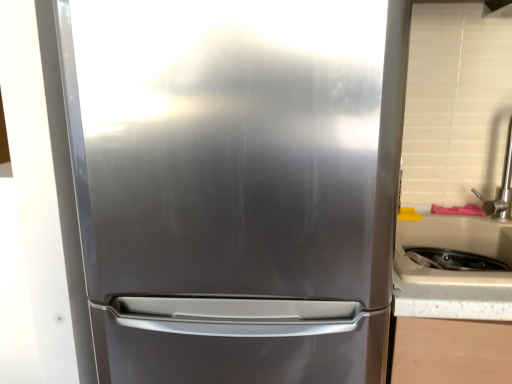
Measure the distance between satin nickel faucet at right and camera.

A distance of 1.27 meters exists between satin nickel faucet at right and camera.

This screenshot has height=384, width=512. What do you see at coordinates (452, 305) in the screenshot?
I see `white speckled laminate at right` at bounding box center [452, 305].

The image size is (512, 384). In order to click on white speckled laminate at right in this screenshot , I will do `click(452, 305)`.

Identify the location of brushed metal exhaust hood at upper right. The image size is (512, 384). (497, 9).

You are a GUI agent. You are given a task and a screenshot of the screen. Output one action in this format:
    pyautogui.click(x=<x>, y=<y>)
    Task: Click on the satin nickel faucet at right
    Image resolution: width=512 pixels, height=384 pixels.
    Given the screenshot: What is the action you would take?
    pyautogui.click(x=501, y=187)

Can you tell me how much stainless steel refrigerator at center and white speckled laminate at right differ in facing direction?

The angular difference between stainless steel refrigerator at center and white speckled laminate at right is 2.15e-05 degrees.

Is stainless steel refrigerator at center in front of white speckled laminate at right?

Yes, stainless steel refrigerator at center is in front of white speckled laminate at right.

Is point (244, 366) closer or farther from the camera than point (402, 227)?

Clearly, point (244, 366) is closer to the camera than point (402, 227).

Is white speckled laminate at right far away from stainless steel refrigerator at center?

No.

From the image's perspective, which one is positioned lower, white speckled laminate at right or stainless steel refrigerator at center?

white speckled laminate at right, from the image's perspective.

Based on their positions, is white speckled laminate at right located to the left or right of stainless steel refrigerator at center?

white speckled laminate at right is to the right of stainless steel refrigerator at center.

Is white speckled laminate at right behind stainless steel refrigerator at center?

Yes, white speckled laminate at right is further from the camera.

From the image's perspective, which is below, white speckled laminate at right or brushed metal exhaust hood at upper right?

white speckled laminate at right.

Is white speckled laminate at right touching brushed metal exhaust hood at upper right?

white speckled laminate at right and brushed metal exhaust hood at upper right are not in contact.

Considering the sizes of objects white speckled laminate at right and brushed metal exhaust hood at upper right in the image provided, who is bigger, white speckled laminate at right or brushed metal exhaust hood at upper right?

white speckled laminate at right.

How distant is white speckled laminate at right from brushed metal exhaust hood at upper right?

white speckled laminate at right and brushed metal exhaust hood at upper right are 34.41 inches apart.

Considering the points (503, 173) and (443, 303), which point is in front, point (503, 173) or point (443, 303)?

The point (443, 303) is more forward.

From a real-world perspective, is satin nickel faucet at right located higher than white speckled laminate at right?

Correct, in the physical world, satin nickel faucet at right is higher than white speckled laminate at right.

How much distance is there between satin nickel faucet at right and white speckled laminate at right?

The distance of satin nickel faucet at right from white speckled laminate at right is 22.95 inches.

Would you say satin nickel faucet at right is inside or outside white speckled laminate at right?

satin nickel faucet at right is outside white speckled laminate at right.

Is stainless steel refrigerator at center next to brushed metal exhaust hood at upper right and touching it?

They are not placed beside each other.

Is stainless steel refrigerator at center wider than brushed metal exhaust hood at upper right?

Indeed, stainless steel refrigerator at center has a greater width compared to brushed metal exhaust hood at upper right.

Which object is more forward, stainless steel refrigerator at center or brushed metal exhaust hood at upper right?

stainless steel refrigerator at center.

Which of these two, stainless steel refrigerator at center or brushed metal exhaust hood at upper right, is bigger?

With larger size is stainless steel refrigerator at center.

From the image's perspective, between stainless steel refrigerator at center and satin nickel faucet at right, which one is located above?

satin nickel faucet at right is shown above in the image.

From the picture: Does stainless steel refrigerator at center have a lesser height compared to satin nickel faucet at right?

No.

Which is more to the left, stainless steel refrigerator at center or satin nickel faucet at right?

Positioned to the left is stainless steel refrigerator at center.

How many degrees apart are the facing directions of stainless steel refrigerator at center and satin nickel faucet at right?

stainless steel refrigerator at center and satin nickel faucet at right are facing 8.32e-05 degrees away from each other.

Between brushed metal exhaust hood at upper right and white speckled laminate at right, which one has larger width?

white speckled laminate at right.

Can you see brushed metal exhaust hood at upper right touching white speckled laminate at right?

brushed metal exhaust hood at upper right and white speckled laminate at right are not in contact.

From a real-world perspective, which is physically below, brushed metal exhaust hood at upper right or white speckled laminate at right?

In real-world perspective, white speckled laminate at right is lower.

Is white speckled laminate at right at the back of brushed metal exhaust hood at upper right?

No, brushed metal exhaust hood at upper right is not facing away from white speckled laminate at right.

Identify the location of counter top that is on the right side of stainless steel refrigerator at center. The height and width of the screenshot is (384, 512). (452, 305).

You are a GUI agent. You are given a task and a screenshot of the screen. Output one action in this format:
    pyautogui.click(x=<x>, y=<y>)
    Task: Click on the counter top behind the stainless steel refrigerator at center
    
    Given the screenshot: What is the action you would take?
    pyautogui.click(x=452, y=305)

Looking at the image, which one is located further to stainless steel refrigerator at center, brushed metal exhaust hood at upper right or white speckled laminate at right?

Among the two, brushed metal exhaust hood at upper right is located further to stainless steel refrigerator at center.

When comparing their distances from white speckled laminate at right, does stainless steel refrigerator at center or brushed metal exhaust hood at upper right seem further?

brushed metal exhaust hood at upper right is further to white speckled laminate at right.

From the image, which object appears to be nearer to white speckled laminate at right, stainless steel refrigerator at center or satin nickel faucet at right?

stainless steel refrigerator at center is positioned closer to the anchor white speckled laminate at right.

Which object lies further to the anchor point white speckled laminate at right, brushed metal exhaust hood at upper right or stainless steel refrigerator at center?

brushed metal exhaust hood at upper right.

When comparing their distances from brushed metal exhaust hood at upper right, does stainless steel refrigerator at center or white speckled laminate at right seem further?

Based on the image, stainless steel refrigerator at center appears to be further to brushed metal exhaust hood at upper right.

From the image, which object appears to be farther from white speckled laminate at right, satin nickel faucet at right or brushed metal exhaust hood at upper right?

brushed metal exhaust hood at upper right is positioned further to the anchor white speckled laminate at right.

Based on their spatial positions, is satin nickel faucet at right or stainless steel refrigerator at center further from white speckled laminate at right?

Among the two, satin nickel faucet at right is located further to white speckled laminate at right.

Looking at this image, when comparing their distances from brushed metal exhaust hood at upper right, does white speckled laminate at right or satin nickel faucet at right seem closer?

satin nickel faucet at right is positioned closer to the anchor brushed metal exhaust hood at upper right.

You are a GUI agent. You are given a task and a screenshot of the screen. Output one action in this format:
    pyautogui.click(x=<x>, y=<y>)
    Task: Click on the counter top between stainless steel refrigerator at center and satin nickel faucet at right
    Image resolution: width=512 pixels, height=384 pixels.
    Given the screenshot: What is the action you would take?
    pyautogui.click(x=452, y=305)

Identify the location of faucet located between stainless steel refrigerator at center and brushed metal exhaust hood at upper right in the left-right direction. This screenshot has height=384, width=512. (501, 187).

You are a GUI agent. You are given a task and a screenshot of the screen. Output one action in this format:
    pyautogui.click(x=<x>, y=<y>)
    Task: Click on the faucet between brushed metal exhaust hood at upper right and white speckled laminate at right vertically
    
    Given the screenshot: What is the action you would take?
    pyautogui.click(x=501, y=187)

Find the location of `refrigerator that lies between brushed metal exhaust hood at upper right and white speckled laminate at right from top to bottom`. refrigerator that lies between brushed metal exhaust hood at upper right and white speckled laminate at right from top to bottom is located at coordinates (236, 185).